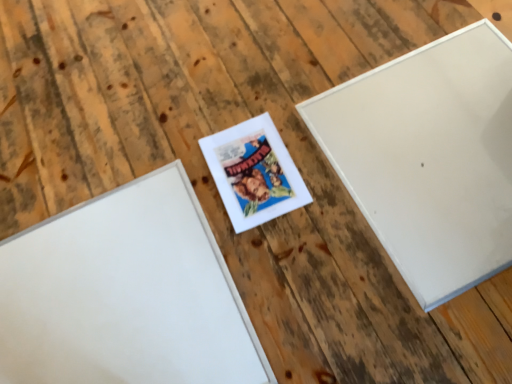
Locate an element on the screen. The width and height of the screenshot is (512, 384). vacant space in front of matte white picture frame at center, the second picture frame from the left is located at coordinates (281, 261).